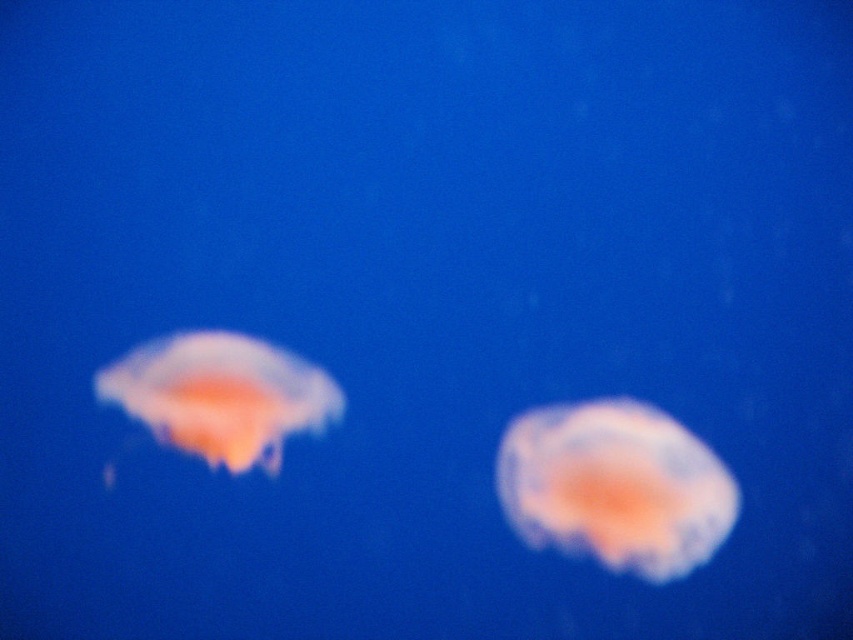
Does translucent orange jellyfish at center appear on the right side of translucent orange jellyfish at left?

Yes, translucent orange jellyfish at center is to the right of translucent orange jellyfish at left.

Between translucent orange jellyfish at center and translucent orange jellyfish at left, which one has less height?

Standing shorter between the two is translucent orange jellyfish at left.

Does point (630, 410) come closer to viewer compared to point (204, 392)?

That is True.

The width and height of the screenshot is (853, 640). Identify the location of translucent orange jellyfish at center. (614, 486).